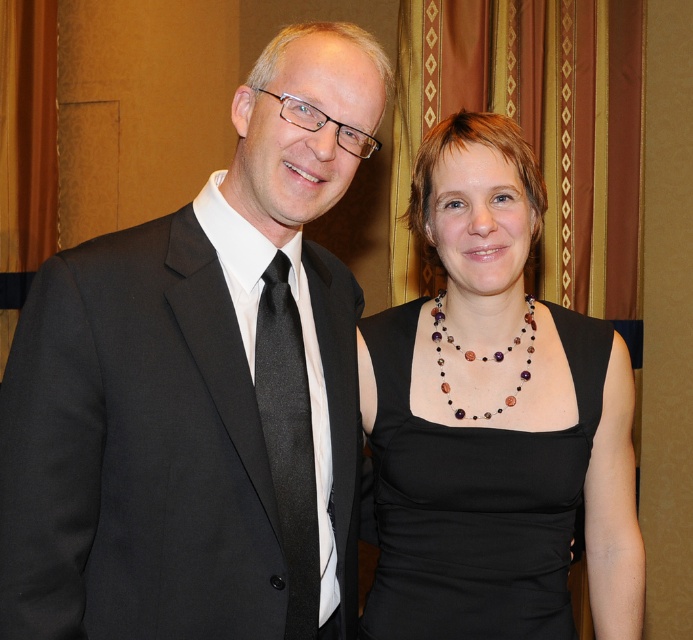
Which is above, black satin suit at center or black silk tie at left?

black satin suit at center is above.

Is point (193, 266) positioned in front of point (317, 570)?

Yes, point (193, 266) is in front of point (317, 570).

The height and width of the screenshot is (640, 693). What do you see at coordinates (200, 388) in the screenshot?
I see `black satin suit at center` at bounding box center [200, 388].

Identify the location of black satin suit at center. (200, 388).

Does black satin suit at center appear on the right side of black matte dress at center?

Incorrect, black satin suit at center is not on the right side of black matte dress at center.

Does black satin suit at center appear under black matte dress at center?

No.

Does point (184, 580) come farther from viewer compared to point (491, 504)?

That is False.

Where is `black satin suit at center`? black satin suit at center is located at coordinates (200, 388).

Who is positioned more to the right, black matte dress at center or black silk tie at left?

black matte dress at center is more to the right.

Is black matte dress at center thinner than black silk tie at left?

In fact, black matte dress at center might be wider than black silk tie at left.

Is point (387, 440) more distant than point (292, 420)?

Yes, point (387, 440) is behind point (292, 420).

This screenshot has width=693, height=640. What are the coordinates of `black matte dress at center` in the screenshot? It's located at pyautogui.click(x=473, y=500).